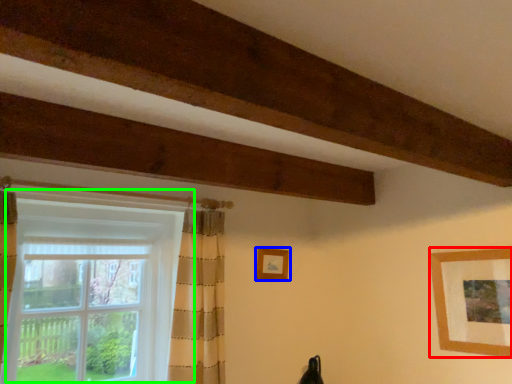
Question: Which is nearer to the picture frame (highlighted by a red box)? picture frame (highlighted by a blue box) or window (highlighted by a green box).

Choices:
 (A) picture frame
 (B) window

Answer: (A)